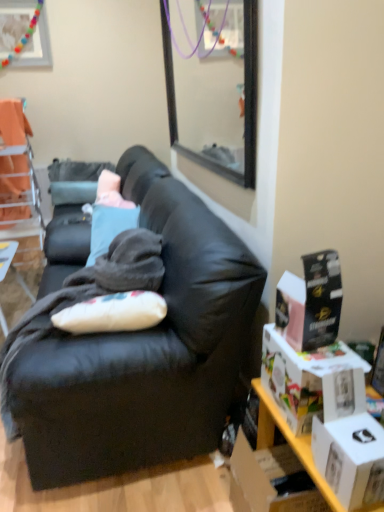
Find the location of a particular element. white cardboard box at right, which is the second box in bottom-to-top order is located at coordinates (312, 380).

What is the approximate height of black leather couch at center?

black leather couch at center is 34.06 inches tall.

Describe the element at coordinates (311, 302) in the screenshot. I see `black cardboard box at right, placed as the third box when sorted from bottom to top` at that location.

Describe the element at coordinates (24, 36) in the screenshot. This screenshot has height=512, width=384. I see `wooden picture frame at upper left` at that location.

This screenshot has width=384, height=512. What do you see at coordinates (18, 177) in the screenshot?
I see `orange fabric chair at upper left` at bounding box center [18, 177].

This screenshot has height=512, width=384. What are the coordinates of `white matte box at lower right, which ranks as the 3th box in top-to-bottom order` in the screenshot? It's located at (351, 458).

The image size is (384, 512). Describe the element at coordinates (14, 275) in the screenshot. I see `wooden table at left` at that location.

The image size is (384, 512). Find the location of `white cardboard boxes at right`. white cardboard boxes at right is located at coordinates (289, 442).

Does white cardboard box at right, positioned as the 2th box in top-to-bottom order, have a larger size compared to wooden table at left?

No, white cardboard box at right, positioned as the 2th box in top-to-bottom order, is not bigger than wooden table at left.

Considering the relative positions of white cardboard box at right, positioned as the 2th box in top-to-bottom order, and wooden table at left in the image provided, is white cardboard box at right, positioned as the 2th box in top-to-bottom order, in front of wooden table at left?

Yes, white cardboard box at right, positioned as the 2th box in top-to-bottom order, is in front of wooden table at left.

Is wooden table at left a part of white cardboard box at right, which is the second box in bottom-to-top order?

No, wooden table at left is not a part of white cardboard box at right, which is the second box in bottom-to-top order.

Does white cardboard box at right, positioned as the 2th box in top-to-bottom order, have a greater height compared to wooden table at left?

In fact, white cardboard box at right, positioned as the 2th box in top-to-bottom order, may be shorter than wooden table at left.

Measure the distance between white cardboard box at right, which is the second box in bottom-to-top order, and orange fabric chair at upper left.

white cardboard box at right, which is the second box in bottom-to-top order, is 2.54 meters from orange fabric chair at upper left.

Considering the points (326, 395) and (16, 138), which point is behind, point (326, 395) or point (16, 138)?

The point (16, 138) is farther from the camera.

From the image's perspective, would you say white cardboard box at right, positioned as the 2th box in top-to-bottom order, is positioned over orange fabric chair at upper left?

Actually, white cardboard box at right, positioned as the 2th box in top-to-bottom order, appears below orange fabric chair at upper left in the image.

From a real-world perspective, is white cardboard box at right, which is the second box in bottom-to-top order, positioned over orange fabric chair at upper left based on gravity?

Actually, white cardboard box at right, which is the second box in bottom-to-top order, is physically below orange fabric chair at upper left in the real world.

Is black leather couch at center positioned before white cardboard boxes at right?

No, black leather couch at center is further to the viewer.

In the scene shown: Choose the correct answer: Is black leather couch at center inside white cardboard boxes at right or outside it?

black leather couch at center is not inside white cardboard boxes at right, it's outside.

Could you tell me if black leather couch at center is turned towards white cardboard boxes at right?

No, black leather couch at center is not oriented towards white cardboard boxes at right.

Is point (97, 352) more distant than point (303, 456)?

Yes, point (97, 352) is farther from viewer.

Can you confirm if white matte box at lower right, the 1th box positioned from the bottom, is bigger than black cardboard box at right, marked as the first box in a top-to-bottom arrangement?

No.

From a real-world perspective, which object stands above the other?

From a 3D spatial view, black cardboard box at right, placed as the third box when sorted from bottom to top, is above.

From the image's perspective, who appears lower, white matte box at lower right, the 1th box positioned from the bottom, or black cardboard box at right, placed as the third box when sorted from bottom to top?

white matte box at lower right, the 1th box positioned from the bottom, is shown below in the image.

Considering the relative sizes of wooden picture frame at upper left and white cardboard box at right, which is the second box in bottom-to-top order, in the image provided, is wooden picture frame at upper left wider than white cardboard box at right, which is the second box in bottom-to-top order,?

No, wooden picture frame at upper left is not wider than white cardboard box at right, which is the second box in bottom-to-top order.

Measure the distance from wooden picture frame at upper left to white cardboard box at right, which is the second box in bottom-to-top order.

They are 12.46 feet apart.

Is wooden picture frame at upper left spatially inside white cardboard box at right, positioned as the 2th box in top-to-bottom order, or outside of it?

wooden picture frame at upper left is outside white cardboard box at right, positioned as the 2th box in top-to-bottom order.

Who is shorter, wooden picture frame at upper left or white cardboard box at right, positioned as the 2th box in top-to-bottom order?

white cardboard box at right, positioned as the 2th box in top-to-bottom order, is shorter.

Is orange fabric chair at upper left aimed at wooden table at left?

No, orange fabric chair at upper left is not turned towards wooden table at left.

From the picture: From a real-world perspective, which object stands above the other?

From a 3D spatial view, orange fabric chair at upper left is above.

Can you tell me how much orange fabric chair at upper left and wooden table at left differ in facing direction?

They differ by 3.09 degrees in their facing directions.

From the image's perspective, which one is positioned lower, orange fabric chair at upper left or black cardboard box at right, placed as the third box when sorted from bottom to top?

black cardboard box at right, placed as the third box when sorted from bottom to top, appears lower in the image.

Find the location of a particular element. Image resolution: width=384 pixels, height=512 pixels. box that is the 1st object directly below the orange fabric chair at upper left (from a real-world perspective) is located at coordinates (311, 302).

How distant is orange fabric chair at upper left from black cardboard box at right, marked as the first box in a top-to-bottom arrangement?

The distance of orange fabric chair at upper left from black cardboard box at right, marked as the first box in a top-to-bottom arrangement, is 2.51 meters.

From the picture: Which of these two, orange fabric chair at upper left or black cardboard box at right, marked as the first box in a top-to-bottom arrangement, is wider?

orange fabric chair at upper left.

Image resolution: width=384 pixels, height=512 pixels. In order to click on the 2nd box to the right of the wooden table at left, counting from the anchor's position in this screenshot , I will do `click(312, 380)`.

This screenshot has width=384, height=512. In order to click on the 2nd box in front of the orange fabric chair at upper left, counting from the anchor's position in this screenshot , I will do `click(312, 380)`.

Which object lies nearer to the anchor point wooden picture frame at upper left, black leather couch at center or white matte box at lower right, which ranks as the 3th box in top-to-bottom order?

black leather couch at center lies closer to wooden picture frame at upper left than the other object.

Based on their spatial positions, is wooden picture frame at upper left or white cardboard boxes at right further from black cardboard box at right, marked as the first box in a top-to-bottom arrangement?

Based on the image, wooden picture frame at upper left appears to be further to black cardboard box at right, marked as the first box in a top-to-bottom arrangement.

When comparing their distances from orange fabric chair at upper left, does black cardboard box at right, placed as the third box when sorted from bottom to top, or wooden table at left seem further?

black cardboard box at right, placed as the third box when sorted from bottom to top, is further to orange fabric chair at upper left.

In the scene shown: Based on their spatial positions, is wooden table at left or wooden picture frame at upper left closer to white cardboard boxes at right?

wooden table at left lies closer to white cardboard boxes at right than the other object.

Considering their positions, is black leather couch at center positioned closer to wooden picture frame at upper left than black cardboard box at right, marked as the first box in a top-to-bottom arrangement?

Among the two, black leather couch at center is located nearer to wooden picture frame at upper left.

When comparing their distances from orange fabric chair at upper left, does wooden table at left or black leather couch at center seem closer?

The object closer to orange fabric chair at upper left is wooden table at left.

Considering their positions, is wooden table at left positioned further to black cardboard box at right, placed as the third box when sorted from bottom to top, than white cardboard boxes at right?

The object further to black cardboard box at right, placed as the third box when sorted from bottom to top, is wooden table at left.

When comparing their distances from white matte box at lower right, the 1th box positioned from the bottom, does wooden table at left or black leather couch at center seem further?

The object further to white matte box at lower right, the 1th box positioned from the bottom, is wooden table at left.

This screenshot has height=512, width=384. Identify the location of table between wooden picture frame at upper left and white matte box at lower right, which ranks as the 3th box in top-to-bottom order, vertically. (14, 275).

In order to click on studio couch located between black cardboard box at right, marked as the first box in a top-to-bottom arrangement, and wooden picture frame at upper left in the depth direction in this screenshot , I will do `click(143, 352)`.

The image size is (384, 512). Find the location of `chair between black leather couch at center and wooden picture frame at upper left in the front-back direction`. chair between black leather couch at center and wooden picture frame at upper left in the front-back direction is located at coordinates (18, 177).

The height and width of the screenshot is (512, 384). In order to click on studio couch between wooden table at left and white cardboard box at right, positioned as the 2th box in top-to-bottom order, in the horizontal direction in this screenshot , I will do `click(143, 352)`.